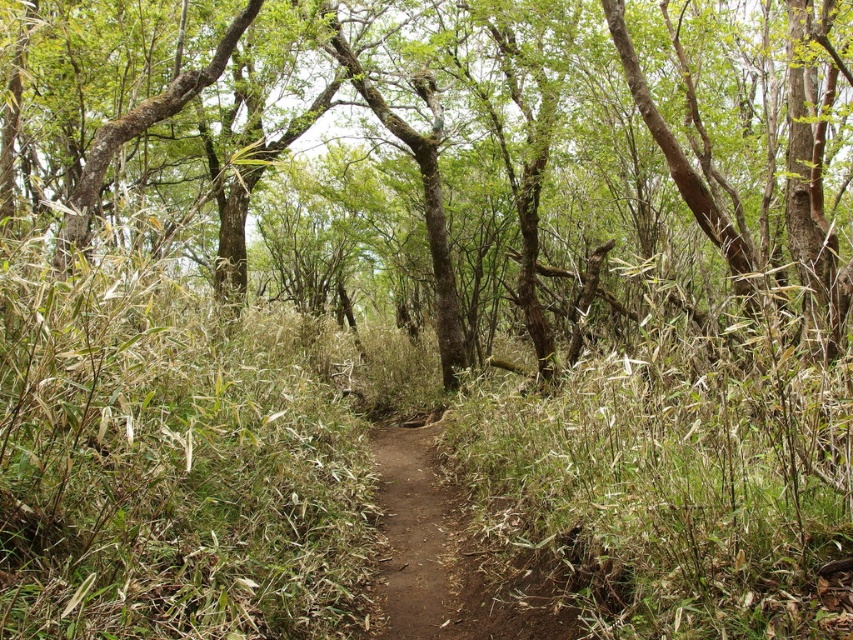
Question: Is green bark tree at center bigger than brown dirt path at center?

Choices:
 (A) yes
 (B) no

Answer: (A)

Question: Can you confirm if green bark tree at center is positioned above brown dirt path at center?

Choices:
 (A) no
 (B) yes

Answer: (B)

Question: Is green bark tree at center to the right of brown dirt path at center from the viewer's perspective?

Choices:
 (A) no
 (B) yes

Answer: (B)

Question: Among these points, which one is farthest from the camera?

Choices:
 (A) (x=138, y=84)
 (B) (x=438, y=552)

Answer: (A)

Question: Which point appears farthest from the camera in this image?

Choices:
 (A) (799, 179)
 (B) (383, 460)

Answer: (B)